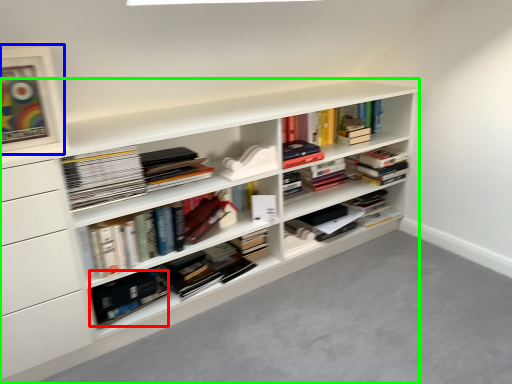
Question: Based on their relative distances, which object is farther from paperback book (highlighted by a red box)? Choose from picture frame (highlighted by a blue box) and shelf (highlighted by a green box).

Choices:
 (A) picture frame
 (B) shelf

Answer: (A)